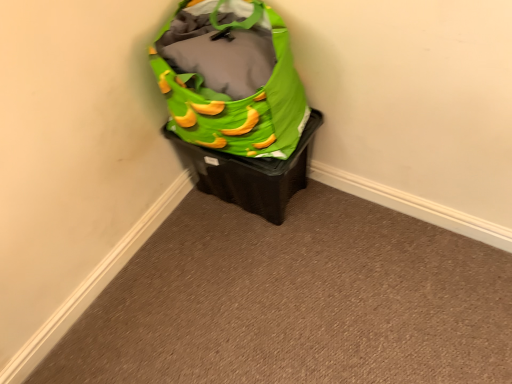
Question: Is green fabric bag at upper center further to camera compared to green fabric bag at upper right?

Choices:
 (A) yes
 (B) no

Answer: (B)

Question: From a real-world perspective, does green fabric bag at upper center stand above green fabric bag at upper right?

Choices:
 (A) no
 (B) yes

Answer: (A)

Question: Is green fabric bag at upper center in contact with green fabric bag at upper right?

Choices:
 (A) yes
 (B) no

Answer: (B)

Question: Can we say green fabric bag at upper center lies outside green fabric bag at upper right?

Choices:
 (A) no
 (B) yes

Answer: (B)

Question: Is green fabric bag at upper center looking in the opposite direction of green fabric bag at upper right?

Choices:
 (A) yes
 (B) no

Answer: (B)

Question: Can you confirm if green fabric bag at upper center is wider than green fabric bag at upper right?

Choices:
 (A) no
 (B) yes

Answer: (B)

Question: From the image's perspective, is green fabric bag at upper right over green fabric bag at upper center?

Choices:
 (A) yes
 (B) no

Answer: (A)

Question: Considering the relative positions of green fabric bag at upper right and green fabric bag at upper center in the image provided, is green fabric bag at upper right in front of green fabric bag at upper center?

Choices:
 (A) no
 (B) yes

Answer: (A)

Question: Would you say green fabric bag at upper right is a long distance from green fabric bag at upper center?

Choices:
 (A) no
 (B) yes

Answer: (A)

Question: Considering the relative positions of green fabric bag at upper right and green fabric bag at upper center in the image provided, is green fabric bag at upper right to the right of green fabric bag at upper center from the viewer's perspective?

Choices:
 (A) yes
 (B) no

Answer: (B)

Question: Is green fabric bag at upper center located within green fabric bag at upper right?

Choices:
 (A) yes
 (B) no

Answer: (B)

Question: Can you confirm if green fabric bag at upper right is shorter than green fabric bag at upper center?

Choices:
 (A) yes
 (B) no

Answer: (B)

Question: Would you consider green fabric bag at upper center to be distant from green fabric bag at upper right?

Choices:
 (A) yes
 (B) no

Answer: (B)